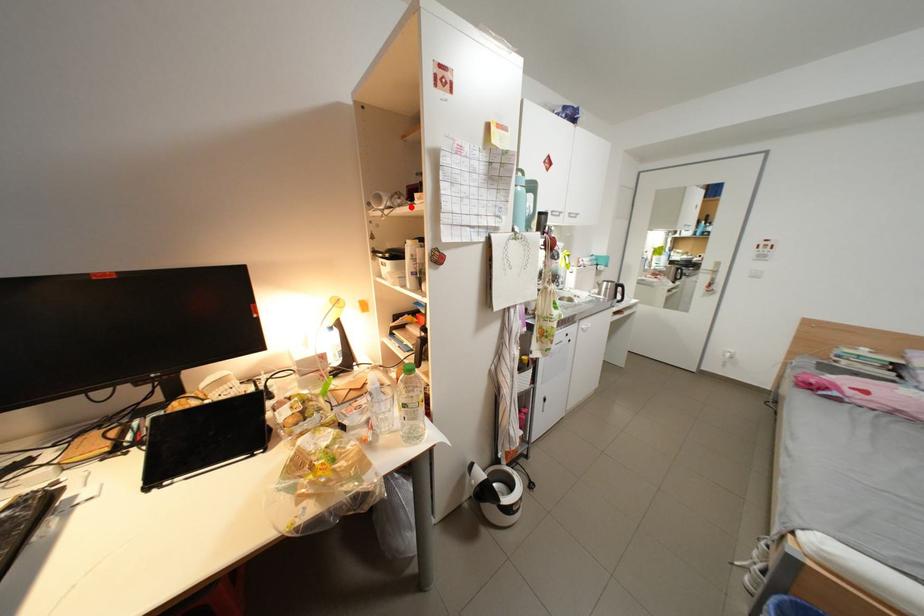
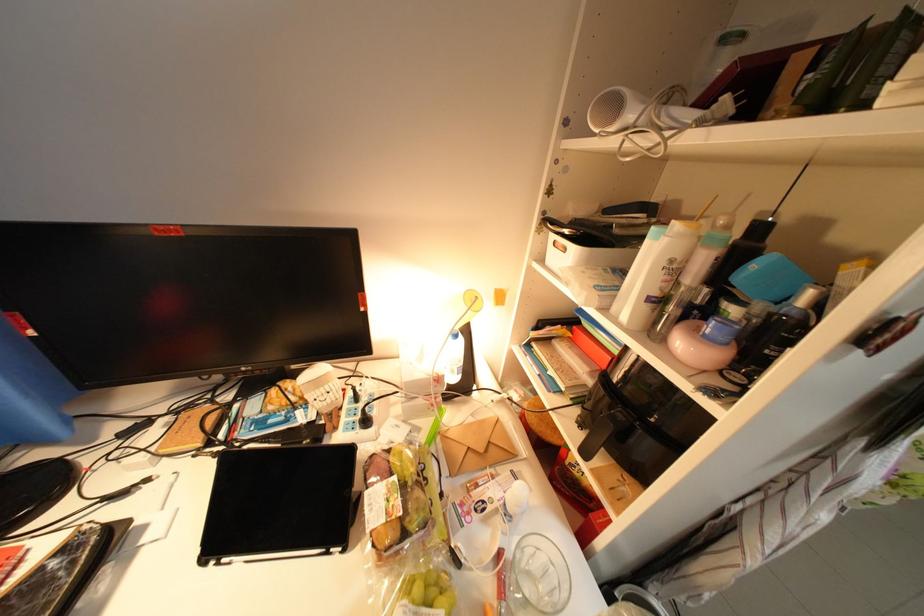
Where in the second image is the point corresponding to the highlighted location from the first image?

(713, 124)